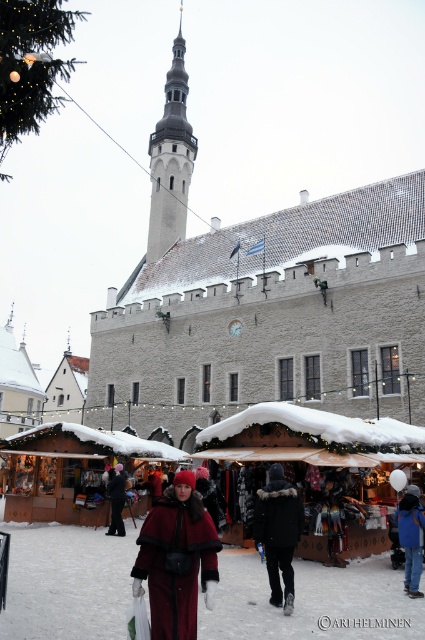
You are standing at the entrance of the market and want to take a photo of the white stone tower at upper center. Based on its position, where should you aim your camera to capture it in the frame?

The white stone tower at upper center is located at point [170,160], so aim your camera towards the upper center area of the scene to capture it in the frame.

You are a customer standing at the entrance of the market. You see a dark blue jacket at lower right and a black matte coat at lower left. Which clothing item is taller?

The dark blue jacket at lower right is taller than the black matte coat at lower left.

You are a customer at the winter market and want to find the velvet red coat at center. According to the coordinates given, where should you look to find it?

The velvet red coat at center is located at coordinates point (176, 557).